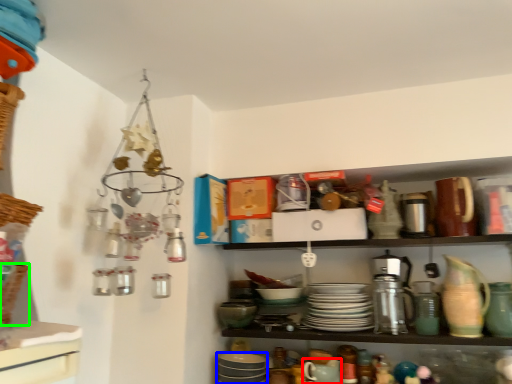
Question: Which object is the farthest from tableware (highlighted by a red box)? Choose among these: tableware (highlighted by a blue box) or basket (highlighted by a green box).

Choices:
 (A) tableware
 (B) basket

Answer: (B)